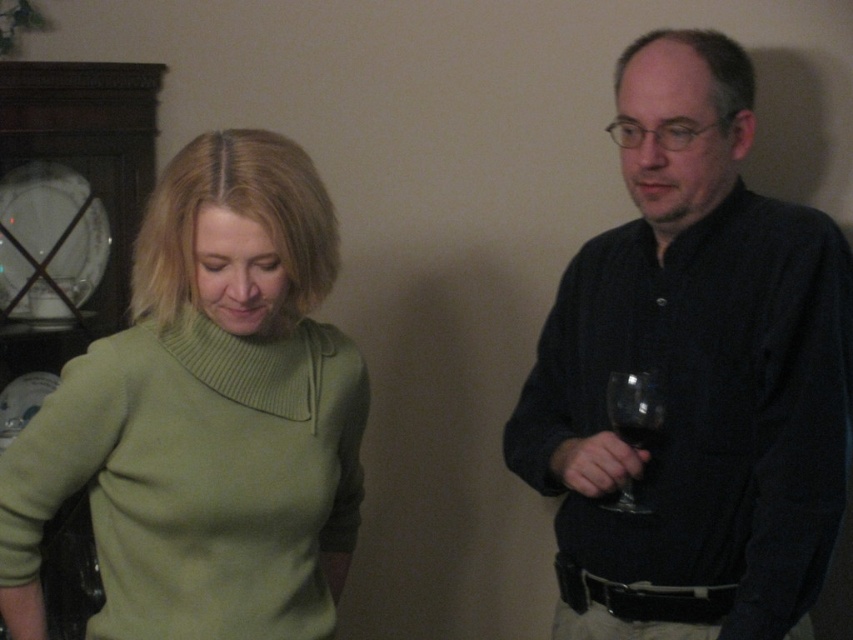
You are standing in the room and want to locate the matte black shirt at right. According to the coordinates provided, where should you look?

The matte black shirt at right is located at coordinates point (695, 371).

You are a photographer setting up a shoot in this living room. You need to position a light source so that it illuminates both the matte black shirt at right and the green knitted sweater at left equally. Considering their positions, which object should be placed closer to the light source to achieve even illumination?

The matte black shirt at right should be placed closer to the light source because it is closer to the viewer than the green knitted sweater at left, so to balance the lighting, positioning it nearer ensures both receive similar illumination.

You are a photographer holding a camera and want to take a picture of the green knitted sweater at left. What is the minimum distance you need to maintain between the camera and the sweater to capture it clearly?

The minimum distance you need to maintain between the camera and the green knitted sweater at left is 38.41 inches, as they are 38.41 inches apart from each other.